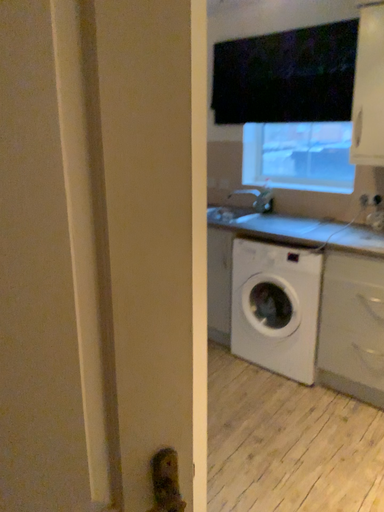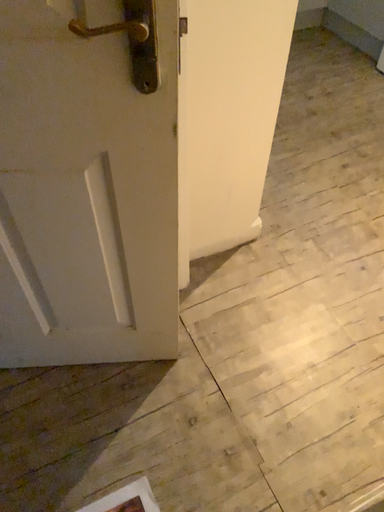
Question: Which way did the camera rotate in the video?

Choices:
 (A) rotated right
 (B) rotated left

Answer: (B)